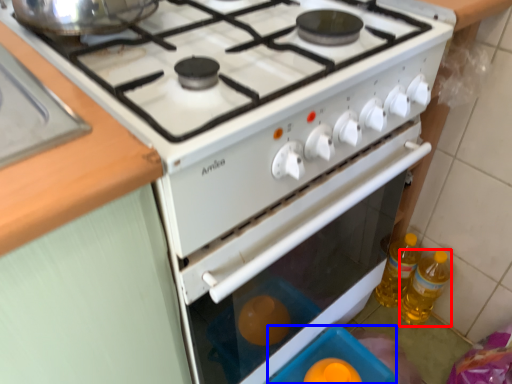
Question: Which of the following is the closest to the observer, bottle (highlighted by a red box) or appliance (highlighted by a blue box)?

Choices:
 (A) bottle
 (B) appliance

Answer: (B)